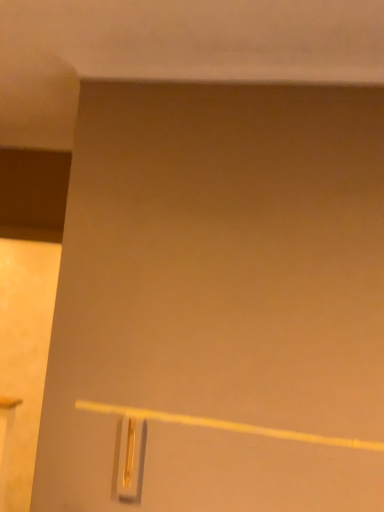
At what (x,y) coordinates should I click in order to perform the action: click on gold metallic door handle at lower center. Please return your answer as a coordinate pair (x, y). The width and height of the screenshot is (384, 512). Looking at the image, I should click on (131, 459).

The image size is (384, 512). What do you see at coordinates (131, 459) in the screenshot?
I see `gold metallic door handle at lower center` at bounding box center [131, 459].

This screenshot has height=512, width=384. Find the location of `gold metallic door handle at lower center`. gold metallic door handle at lower center is located at coordinates (131, 459).